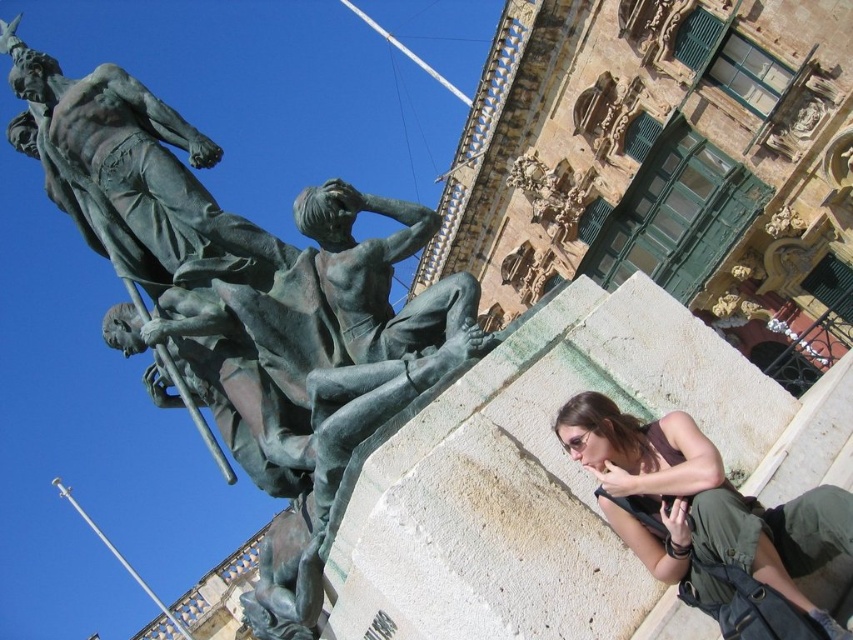
Between bronze statue at upper left and green patina statue at upper left, which one has more height?

bronze statue at upper left is taller.

Can you confirm if bronze statue at upper left is positioned to the left of green patina statue at upper left?

Incorrect, bronze statue at upper left is not on the left side of green patina statue at upper left.

Image resolution: width=853 pixels, height=640 pixels. Identify the location of bronze statue at upper left. tap(210, 257).

Describe the element at coordinates (210, 257) in the screenshot. The height and width of the screenshot is (640, 853). I see `bronze statue at upper left` at that location.

Does bronze statue at upper left have a greater height compared to matte brown hair at lower right?

Correct, bronze statue at upper left is much taller as matte brown hair at lower right.

Where is `bronze statue at upper left`? Image resolution: width=853 pixels, height=640 pixels. bronze statue at upper left is located at coordinates (210, 257).

In order to click on bronze statue at upper left in this screenshot , I will do `click(210, 257)`.

Which of these two, bronze statue at center or green patina statue at upper left, stands shorter?

green patina statue at upper left

Can you confirm if bronze statue at center is positioned to the left of green patina statue at upper left?

Incorrect, bronze statue at center is not on the left side of green patina statue at upper left.

Is point (320, 272) positioned in front of point (107, 221)?

Yes, it is in front of point (107, 221).

Find the location of `bronze statue at center`. bronze statue at center is located at coordinates (357, 378).